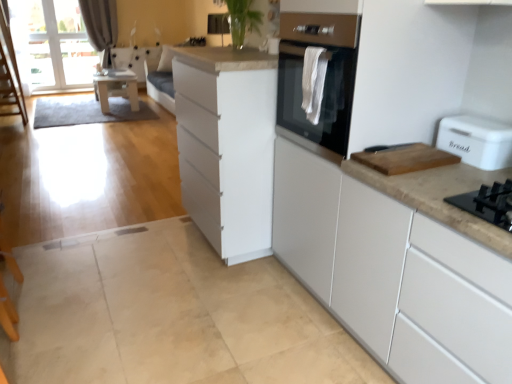
The width and height of the screenshot is (512, 384). What do you see at coordinates (51, 44) in the screenshot?
I see `transparent glass window screen at upper left` at bounding box center [51, 44].

I want to click on white matte cabinet at center, marked as the 2th cabinetry in a right-to-left arrangement, so click(x=227, y=145).

The image size is (512, 384). What do you see at coordinates (403, 158) in the screenshot?
I see `wooden cutting board at right` at bounding box center [403, 158].

This screenshot has height=384, width=512. What do you see at coordinates (385, 192) in the screenshot?
I see `white matte cabinet at center, the 2th cabinetry in the left-to-right sequence` at bounding box center [385, 192].

At what (x,y) coordinates should I click in order to perform the action: click on gray fabric curtain at upper left. Please return your answer as a coordinate pair (x, y). This screenshot has height=384, width=512. Looking at the image, I should click on [101, 26].

Identify the location of transparent glass window screen at upper left. The image size is (512, 384). (51, 44).

From a real-world perspective, is gray fabric curtain at upper left beneath white plastic bread bin at right?

Yes, from a real-world perspective, gray fabric curtain at upper left is beneath white plastic bread bin at right.

Is gray fabric curtain at upper left facing towards white plastic bread bin at right?

Yes.

Can you tell me how much gray fabric curtain at upper left and white plastic bread bin at right differ in facing direction?

86.9 degrees separate the facing orientations of gray fabric curtain at upper left and white plastic bread bin at right.

Considering the relative sizes of gray fabric curtain at upper left and white plastic bread bin at right in the image provided, is gray fabric curtain at upper left thinner than white plastic bread bin at right?

No.

The height and width of the screenshot is (384, 512). In order to click on window screen behind the white matte cabinet at center, the 2th cabinetry in the left-to-right sequence in this screenshot , I will do `click(51, 44)`.

Between point (456, 349) and point (25, 9), which one is positioned in front?

Point (456, 349)

From the image's perspective, between white matte cabinet at center, the 2th cabinetry in the left-to-right sequence, and transparent glass window screen at upper left, who is located below?

white matte cabinet at center, the 2th cabinetry in the left-to-right sequence, is shown below in the image.

Does white matte cabinet at center, which is counted as the 1th cabinetry, starting from the right, turn towards transparent glass window screen at upper left?

No, white matte cabinet at center, which is counted as the 1th cabinetry, starting from the right, is not facing towards transparent glass window screen at upper left.

Can you confirm if transparent glass window screen at upper left is bigger than white matte cabinet at center, which is counted as the 1th cabinetry, starting from the right?

Actually, transparent glass window screen at upper left might be smaller than white matte cabinet at center, which is counted as the 1th cabinetry, starting from the right.

Is transparent glass window screen at upper left facing towards white matte cabinet at center, which is counted as the 1th cabinetry, starting from the right?

Yes.

Can you see transparent glass window screen at upper left touching white matte cabinet at center, the 2th cabinetry in the left-to-right sequence?

They are not placed beside each other.

Does transparent glass window screen at upper left have a greater width compared to white matte cabinet at center, the 2th cabinetry in the left-to-right sequence?

No.

From the image's perspective, is white matte cabinet at center, marked as the 2th cabinetry in a right-to-left arrangement, over gray fabric curtain at upper left?

No, from the image's perspective, white matte cabinet at center, marked as the 2th cabinetry in a right-to-left arrangement, is not over gray fabric curtain at upper left.

Which of these two, white matte cabinet at center, marked as the 2th cabinetry in a right-to-left arrangement, or gray fabric curtain at upper left, is thinner?

With smaller width is gray fabric curtain at upper left.

Is point (248, 84) positioned after point (91, 36)?

That is False.

Considering the sizes of objects white matte cabinet at center, marked as the 2th cabinetry in a right-to-left arrangement, and gray fabric curtain at upper left in the image provided, who is shorter, white matte cabinet at center, marked as the 2th cabinetry in a right-to-left arrangement, or gray fabric curtain at upper left?

white matte cabinet at center, marked as the 2th cabinetry in a right-to-left arrangement.

Between white matte cabinet at center, marked as the 2th cabinetry in a right-to-left arrangement, and white matte cabinet at center, the 2th cabinetry in the left-to-right sequence, which one has larger width?

white matte cabinet at center, the 2th cabinetry in the left-to-right sequence, is wider.

Is point (184, 111) in front of point (372, 265)?

That is False.

Can you see white matte cabinet at center, positioned as the 1th cabinetry in left-to-right order, touching white matte cabinet at center, the 2th cabinetry in the left-to-right sequence?

No.

Does white matte cabinet at center, positioned as the 1th cabinetry in left-to-right order, have a smaller size compared to white matte cabinet at center, the 2th cabinetry in the left-to-right sequence?

Indeed, white matte cabinet at center, positioned as the 1th cabinetry in left-to-right order, has a smaller size compared to white matte cabinet at center, the 2th cabinetry in the left-to-right sequence.

Does wooden table at left appear on the left side of gray fabric curtain at upper left?

Incorrect, wooden table at left is not on the left side of gray fabric curtain at upper left.

Is wooden table at left closer to camera compared to gray fabric curtain at upper left?

Yes, it is.

Consider the image. Does wooden table at left have a lesser height compared to gray fabric curtain at upper left?

Yes.

Can you tell me how much wooden table at left and gray fabric curtain at upper left differ in facing direction?

The facing directions of wooden table at left and gray fabric curtain at upper left are 88.7 degrees apart.

Is white matte cabinet at center, marked as the 2th cabinetry in a right-to-left arrangement, touching wooden cutting board at right?

white matte cabinet at center, marked as the 2th cabinetry in a right-to-left arrangement, and wooden cutting board at right are not in contact.

Based on the photo, looking at their sizes, would you say white matte cabinet at center, positioned as the 1th cabinetry in left-to-right order, is wider or thinner than wooden cutting board at right?

→ Considering their sizes, white matte cabinet at center, positioned as the 1th cabinetry in left-to-right order, looks broader than wooden cutting board at right.

Is white matte cabinet at center, marked as the 2th cabinetry in a right-to-left arrangement, to the right of wooden cutting board at right from the viewer's perspective?

No, white matte cabinet at center, marked as the 2th cabinetry in a right-to-left arrangement, is not to the right of wooden cutting board at right.

Does white matte cabinet at center, marked as the 2th cabinetry in a right-to-left arrangement, have a greater height compared to wooden cutting board at right?

Correct, white matte cabinet at center, marked as the 2th cabinetry in a right-to-left arrangement, is much taller as wooden cutting board at right.

Locate an element on the screen. Image resolution: width=512 pixels, height=384 pixels. home appliance on the right side of gray fabric curtain at upper left is located at coordinates (476, 141).

From a real-world perspective, starting from the transparent glass window screen at upper left, which cabinetry is the 1st one below it? Please provide its 2D coordinates.

[(385, 192)]

Looking at the image, which one is located closer to transparent glass window screen at upper left, white plastic bread bin at right or white matte cabinet at center, positioned as the 1th cabinetry in left-to-right order?

white matte cabinet at center, positioned as the 1th cabinetry in left-to-right order, is positioned closer to the anchor transparent glass window screen at upper left.

Considering their positions, is wooden cutting board at right positioned closer to wooden table at left than white plastic bread bin at right?

The object closer to wooden table at left is wooden cutting board at right.

Based on their spatial positions, is wooden cutting board at right or transparent glass window screen at upper left further from wooden table at left?

wooden cutting board at right is further to wooden table at left.

Based on their spatial positions, is wooden cutting board at right or white matte cabinet at center, which is counted as the 1th cabinetry, starting from the right, closer to wooden table at left?

Among the two, white matte cabinet at center, which is counted as the 1th cabinetry, starting from the right, is located nearer to wooden table at left.

Based on their spatial positions, is wooden table at left or white matte cabinet at center, marked as the 2th cabinetry in a right-to-left arrangement, closer to wooden cutting board at right?

Among the two, white matte cabinet at center, marked as the 2th cabinetry in a right-to-left arrangement, is located nearer to wooden cutting board at right.

When comparing their distances from white plastic bread bin at right, does wooden table at left or white matte cabinet at center, which is counted as the 1th cabinetry, starting from the right, seem further?

The object further to white plastic bread bin at right is wooden table at left.

Estimate the real-world distances between objects in this image. Which object is further from wooden cutting board at right, white matte cabinet at center, the 2th cabinetry in the left-to-right sequence, or white matte cabinet at center, marked as the 2th cabinetry in a right-to-left arrangement?

The object further to wooden cutting board at right is white matte cabinet at center, marked as the 2th cabinetry in a right-to-left arrangement.

Considering their positions, is white plastic bread bin at right positioned further to wooden cutting board at right than wooden table at left?

wooden table at left is positioned further to the anchor wooden cutting board at right.

The width and height of the screenshot is (512, 384). What are the coordinates of `table positioned between white matte cabinet at center, the 2th cabinetry in the left-to-right sequence, and gray fabric curtain at upper left from near to far` in the screenshot? It's located at (116, 88).

You are a GUI agent. You are given a task and a screenshot of the screen. Output one action in this format:
    pyautogui.click(x=<x>, y=<y>)
    Task: Click on the appliance located between white plastic bread bin at right and transparent glass window screen at upper left in the depth direction
    
    Given the screenshot: What is the action you would take?
    pyautogui.click(x=403, y=158)

Where is `window screen located between white matte cabinet at center, marked as the 2th cabinetry in a right-to-left arrangement, and gray fabric curtain at upper left in the depth direction`? This screenshot has width=512, height=384. window screen located between white matte cabinet at center, marked as the 2th cabinetry in a right-to-left arrangement, and gray fabric curtain at upper left in the depth direction is located at coordinates (51, 44).

In order to click on appliance between white matte cabinet at center, the 2th cabinetry in the left-to-right sequence, and white plastic bread bin at right in this screenshot , I will do `click(403, 158)`.